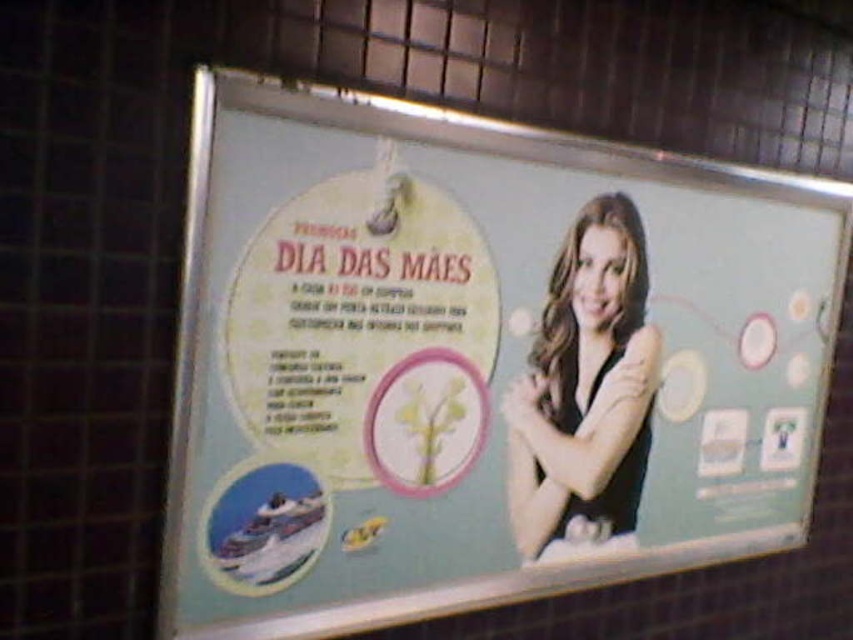
Who is more distant from viewer, (335, 266) or (549, 400)?

The point (549, 400) is behind.

Locate an element on the screen. light blue paper at center is located at coordinates (477, 362).

Locate an element on the screen. The image size is (853, 640). light blue paper at center is located at coordinates (477, 362).